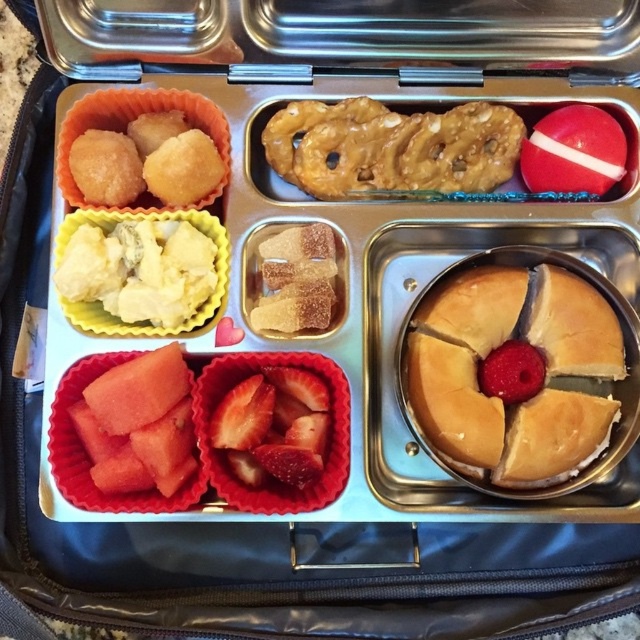
Question: Which point is farther to the camera?

Choices:
 (A) (602, 147)
 (B) (168, 401)
 (C) (208, 312)

Answer: (A)

Question: Which of the following is the farthest from the observer?

Choices:
 (A) sugary brown cubes at center
 (B) yellow creamy cheese at upper left
 (C) matte yellow cupcake at upper left
 (D) strawberrysmoothfruit at center

Answer: (A)

Question: Does pink juicy watermelon at lower left lie behind shiny red apple at upper right?

Choices:
 (A) no
 (B) yes

Answer: (A)

Question: Which point is farther to the camera?

Choices:
 (A) tap(474, 275)
 (B) tap(221, 253)
 (C) tap(106, 102)

Answer: (C)

Question: Does golden brown cake at center have a smaller size compared to strawberrysmoothfruit at center?

Choices:
 (A) yes
 (B) no

Answer: (B)

Question: Can you confirm if golden brown cake at center is wider than yellow creamy cheese at upper left?

Choices:
 (A) yes
 (B) no

Answer: (A)